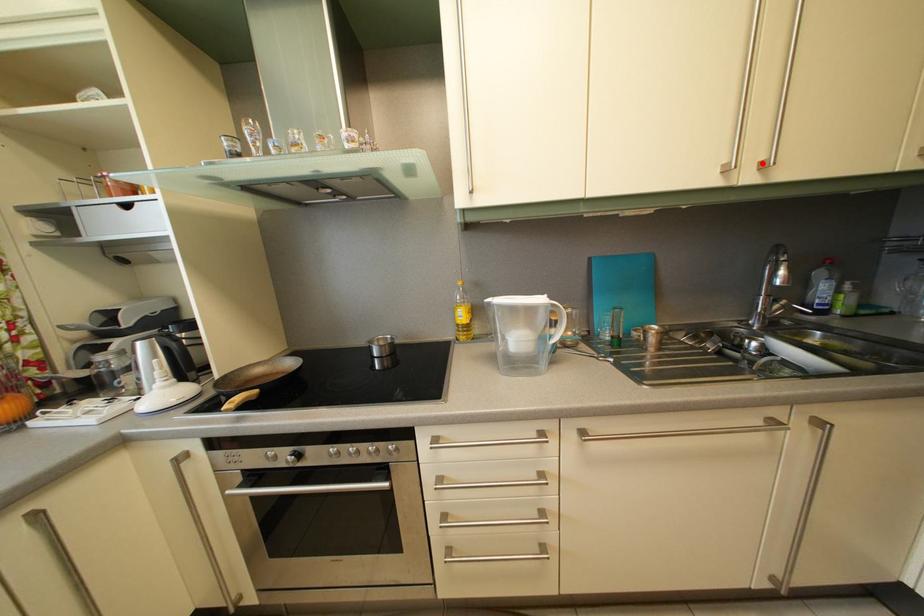
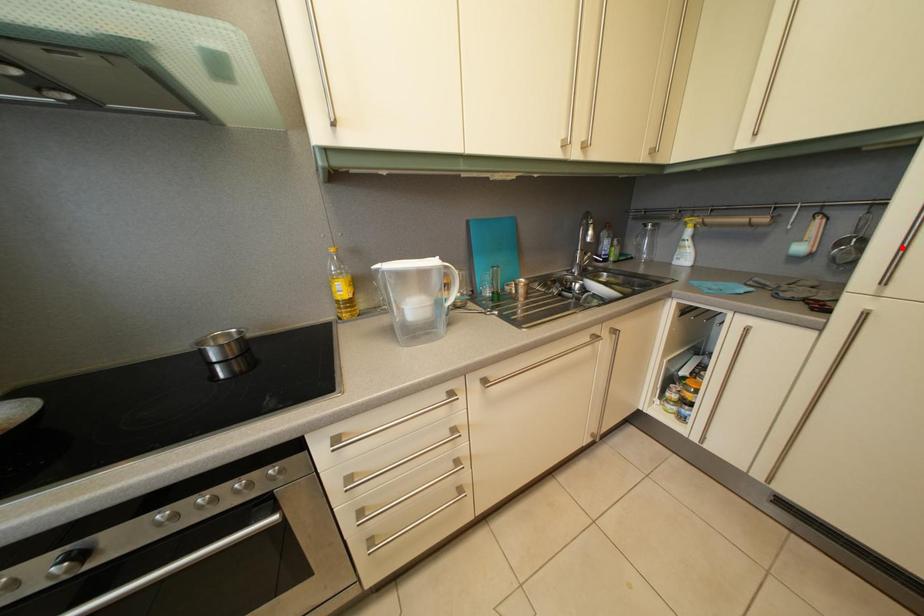
Looking at this image, I am providing you with two images of the same scene from different viewpoints. A red point is marked on the first image and another point is marked on the second image. Are the points marked in image1 and image2 representing the same 3D position?

No